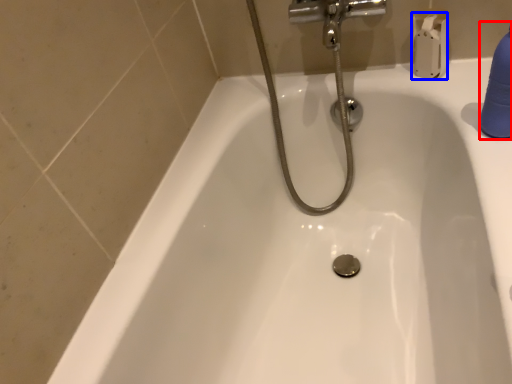
Question: Which object is further to the camera taking this photo, cleaning product (highlighted by a red box) or toilet paper (highlighted by a blue box)?

Choices:
 (A) cleaning product
 (B) toilet paper

Answer: (B)